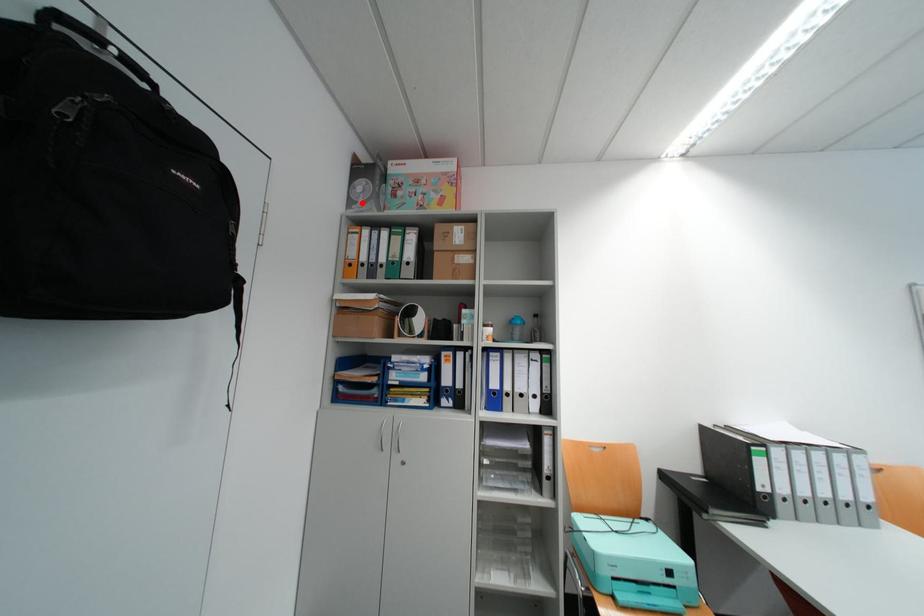
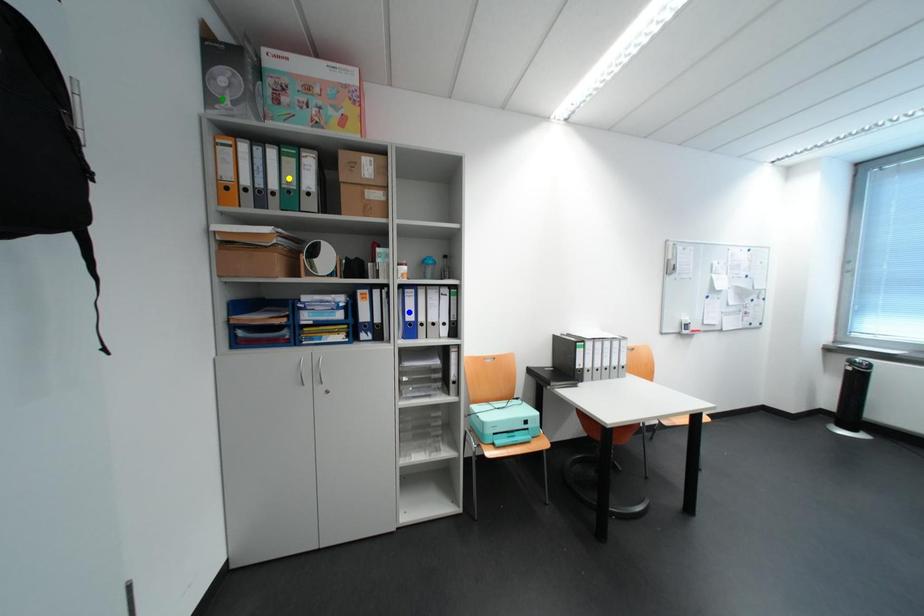
Question: I am providing you with two images of the same scene from different viewpoints. A red point is marked on the first image. You are given multiple points on the second image. Can you choose the point in image 2 that corresponds to the point in image 1?

Choices:
 (A) yellow point
 (B) green point
 (C) blue point

Answer: (B)